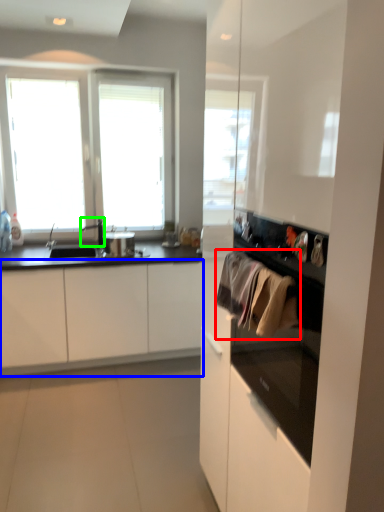
Question: Considering the real-world distances, which object is farthest from laundry (highlighted by a red box)? cabinetry (highlighted by a blue box) or faucet (highlighted by a green box)?

Choices:
 (A) cabinetry
 (B) faucet

Answer: (B)